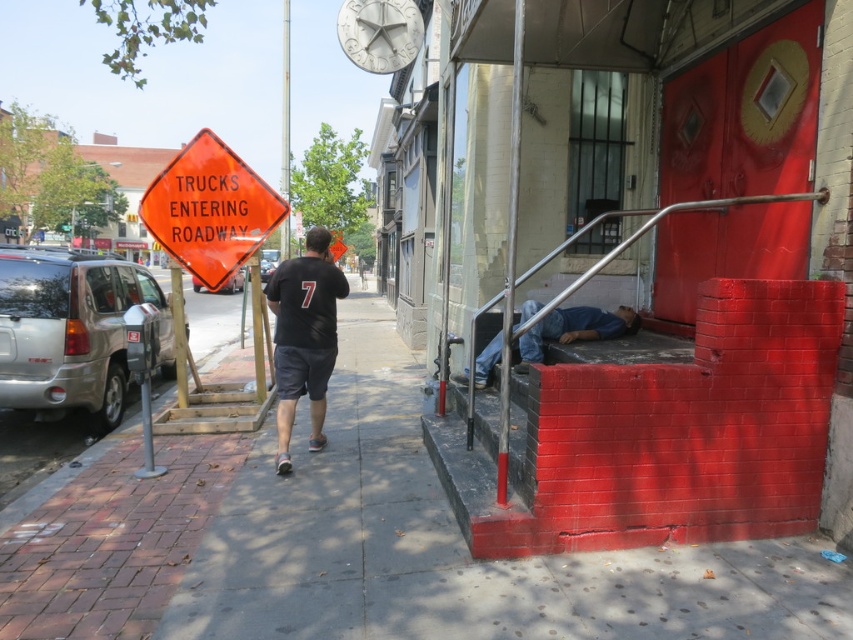
Question: Is white stone clock at upper center above metal at right?

Choices:
 (A) yes
 (B) no

Answer: (A)

Question: Which point is closer to the camera?

Choices:
 (A) (306, 268)
 (B) (486, 307)

Answer: (A)

Question: Which of these objects is positioned farthest from the metal at right?

Choices:
 (A) black matte t-shirt at center
 (B) orange diamond-shaped sign at upper left
 (C) blue jeans at lower right

Answer: (B)

Question: Does black matte t-shirt at center have a smaller size compared to white stone clock at upper center?

Choices:
 (A) no
 (B) yes

Answer: (A)

Question: Which of the following is the farthest from the observer?

Choices:
 (A) (189, 179)
 (B) (573, 317)
 (C) (386, 56)
 (D) (637, 211)

Answer: (C)

Question: Can you confirm if blue jeans at lower right is positioned below white stone clock at upper center?

Choices:
 (A) no
 (B) yes

Answer: (B)